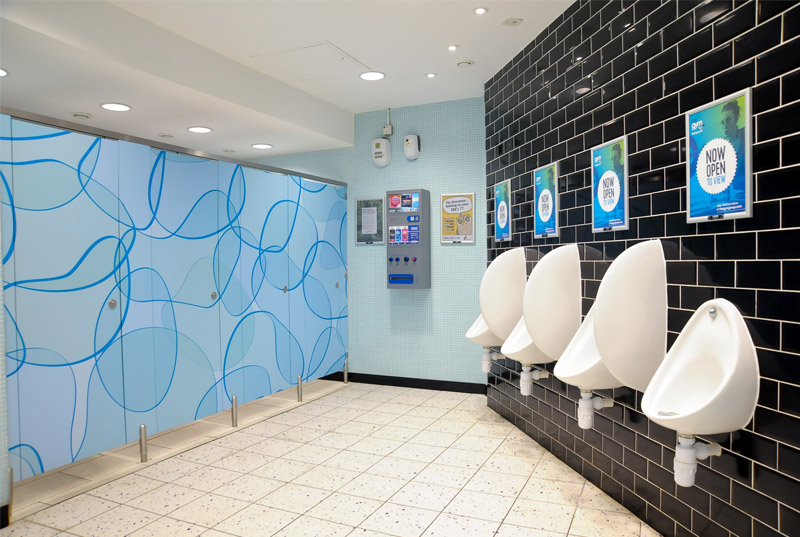
Locate an element on the screen. urinal pipe is located at coordinates click(x=685, y=465), click(x=582, y=412), click(x=522, y=384), click(x=484, y=364).